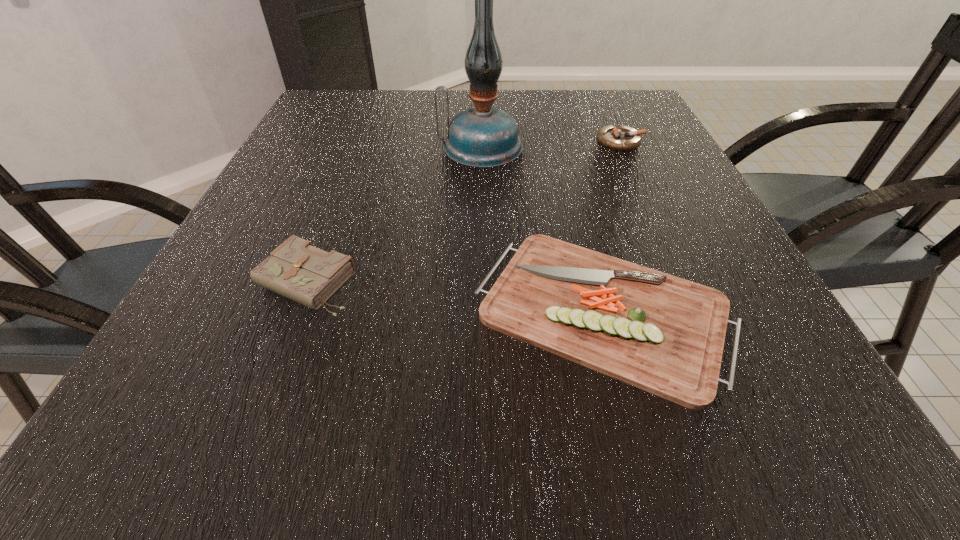
Point out which object is positioned as the third nearest to the leftmost object. Please provide its 2D coordinates. Your answer should be formatted as a tuple, i.e. [(x, y)], where the tuple contains the x and y coordinates of a point satisfying the conditions above.

[(620, 138)]

Identify the location of vacant region that satisfies the following two spatial constraints: 1. on the back side of the ashtray; 2. on the right side of the chopping board. Image resolution: width=960 pixels, height=540 pixels. (560, 141).

The height and width of the screenshot is (540, 960). Find the location of `vacant area that satisfies the following two spatial constraints: 1. on the front side of the chopping board; 2. on the left side of the diary`. vacant area that satisfies the following two spatial constraints: 1. on the front side of the chopping board; 2. on the left side of the diary is located at coordinates (296, 309).